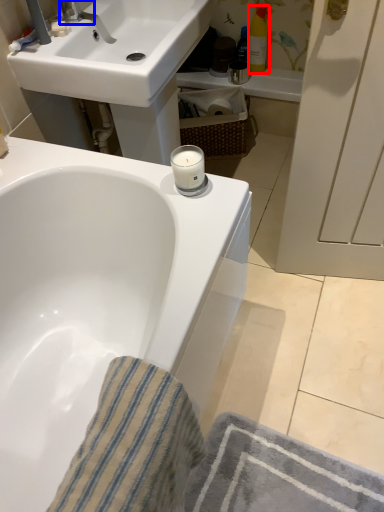
Question: Which of the following is the farthest to the observer, toiletry (highlighted by a red box) or plumbing fixture (highlighted by a blue box)?

Choices:
 (A) toiletry
 (B) plumbing fixture

Answer: (A)